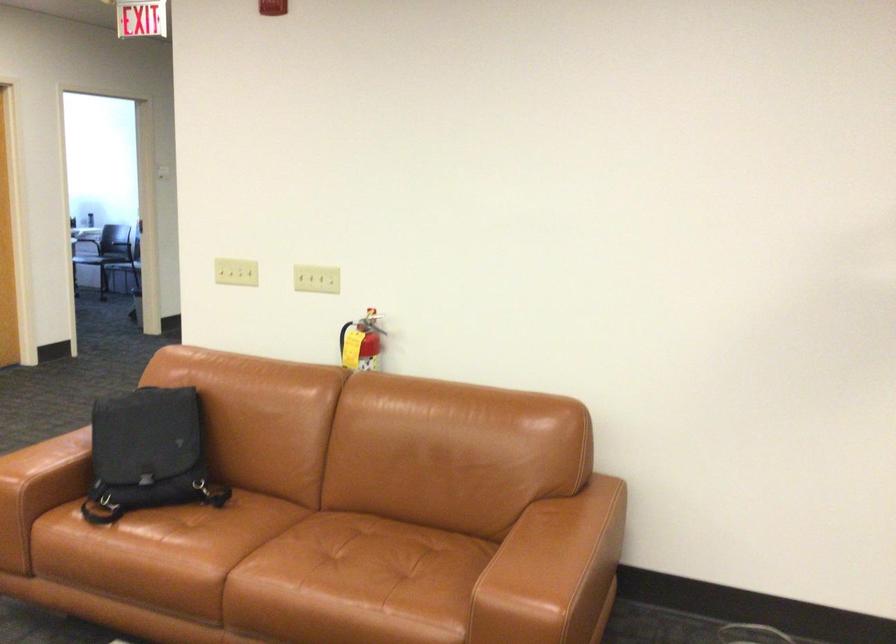
The width and height of the screenshot is (896, 644). In order to click on fire extinguisher pin in this screenshot , I will do `click(359, 348)`.